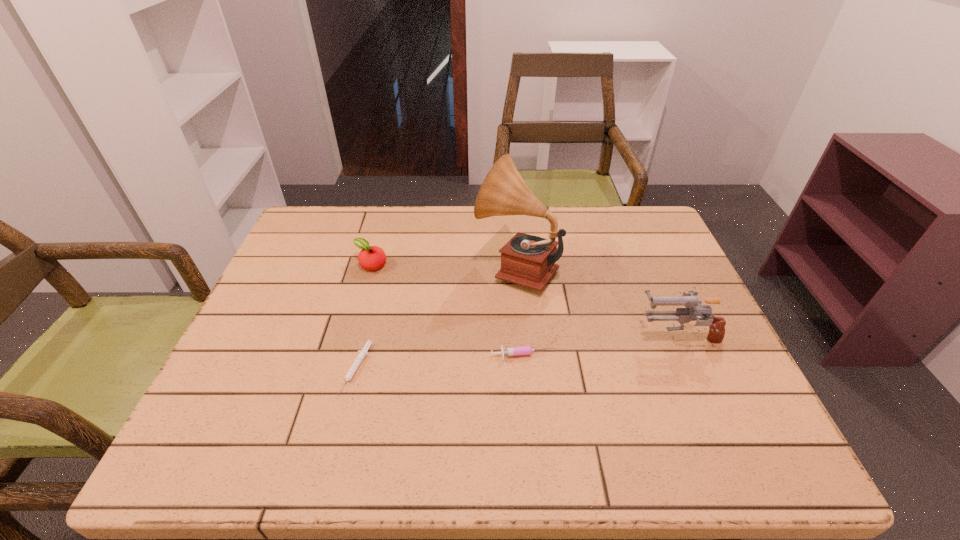
Find the location of a particular element. The width and height of the screenshot is (960, 540). unoccupied position between the taller syringe and the phonograph record is located at coordinates (520, 312).

You are a GUI agent. You are given a task and a screenshot of the screen. Output one action in this format:
    pyautogui.click(x=<x>, y=<y>)
    Task: Click on the vacant space that's between the fourth tallest object and the left syringe
    
    Given the screenshot: What is the action you would take?
    [x=441, y=362]

The height and width of the screenshot is (540, 960). In order to click on unoccupied position between the second tallest object and the phonograph record in this screenshot , I will do `click(597, 301)`.

Where is `free area in between the shorter syringe and the right syringe`? The height and width of the screenshot is (540, 960). free area in between the shorter syringe and the right syringe is located at coordinates (441, 362).

Where is `blank region between the tallest object and the left syringe`? This screenshot has width=960, height=540. blank region between the tallest object and the left syringe is located at coordinates (437, 318).

At what (x,y) coordinates should I click in order to perform the action: click on unoccupied position between the taller syringe and the shortest object. Please return your answer as a coordinate pair (x, y). The height and width of the screenshot is (540, 960). Looking at the image, I should click on (441, 362).

Where is `object that ranks as the fourth closest to the apple`? The width and height of the screenshot is (960, 540). object that ranks as the fourth closest to the apple is located at coordinates (694, 308).

Where is `object that stands as the fourth closest to the rightmost object`? The width and height of the screenshot is (960, 540). object that stands as the fourth closest to the rightmost object is located at coordinates (370, 258).

Find the location of `free point that satisfies the following two spatial constraints: 1. on the horn of the tallest object; 2. on the front side of the left syringe`. free point that satisfies the following two spatial constraints: 1. on the horn of the tallest object; 2. on the front side of the left syringe is located at coordinates (526, 369).

The width and height of the screenshot is (960, 540). Identify the location of free location that satisfies the following two spatial constraints: 1. at the barrel end of the fourth shortest object; 2. on the front side of the taller syringe. (686, 356).